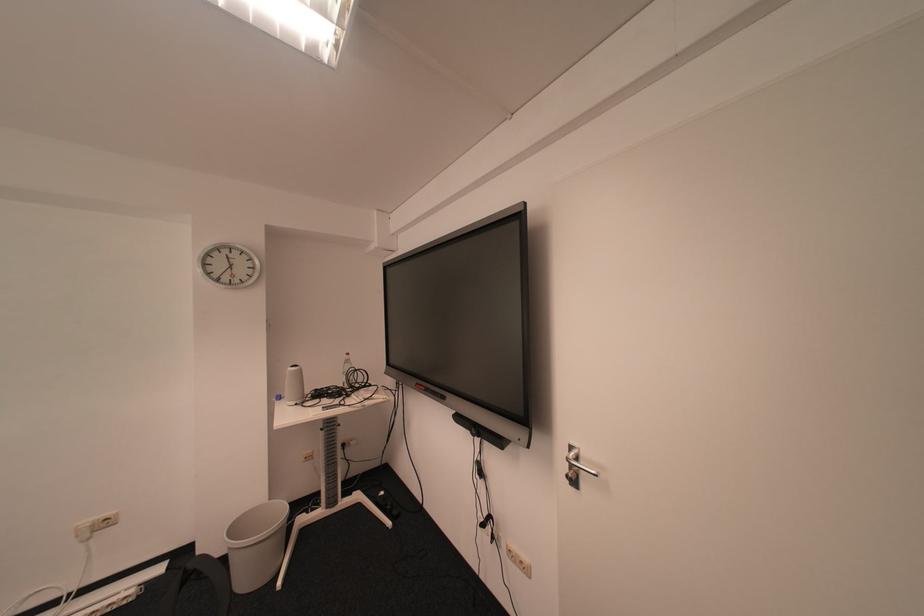
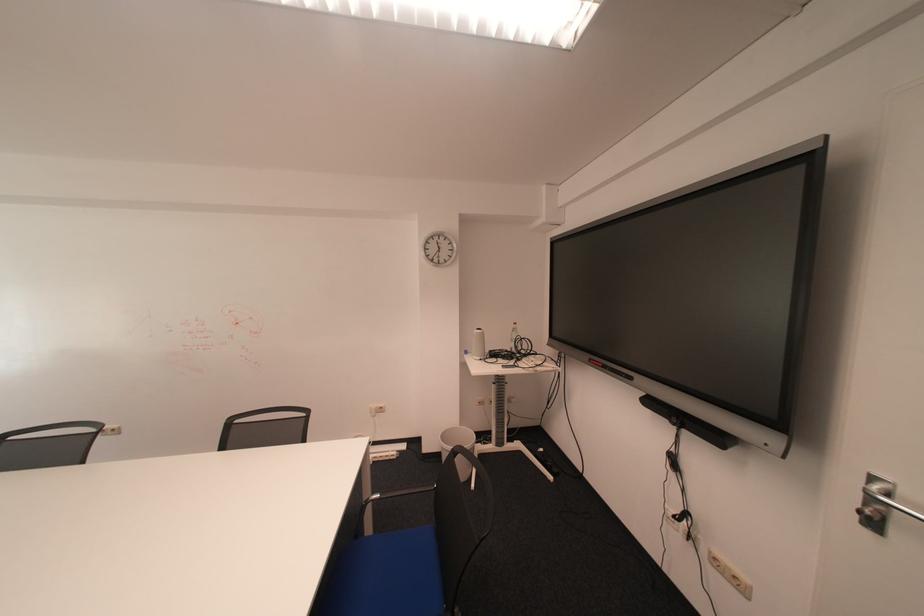
Looking at this image, which direction would the cameraman need to move to produce the second image?

The cameraman walked toward left, backward.